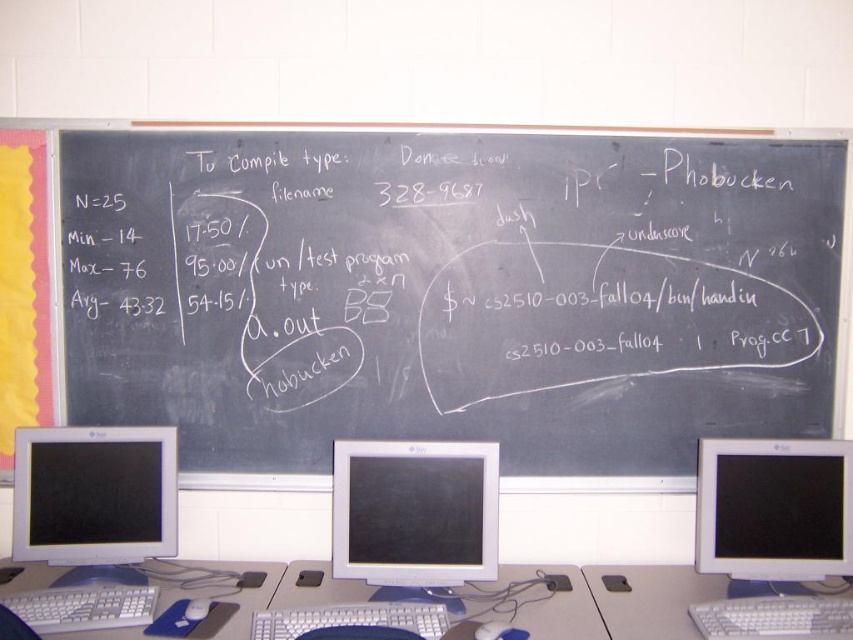
Can you confirm if white glossy monitor at center is wider than white plastic keyboard at center?

In fact, white glossy monitor at center might be narrower than white plastic keyboard at center.

Who is higher up, white glossy monitor at center or white plastic keyboard at center?

white glossy monitor at center is above.

The image size is (853, 640). What do you see at coordinates (415, 513) in the screenshot? I see `white glossy monitor at center` at bounding box center [415, 513].

Identify the location of white glossy monitor at center. The image size is (853, 640). (415, 513).

Is white glossy monitor at center bigger than white plastic table at lower right?

No, white glossy monitor at center is not bigger than white plastic table at lower right.

Is point (373, 525) closer to camera compared to point (635, 580)?

Yes, point (373, 525) is in front of point (635, 580).

Between point (467, 564) and point (630, 612), which one is positioned behind?

Positioned behind is point (467, 564).

This screenshot has width=853, height=640. I want to click on white glossy monitor at center, so click(415, 513).

Between black chalkboard at center and white plastic table at center, which one has more height?

With more height is black chalkboard at center.

Can you confirm if black chalkboard at center is thinner than white plastic table at center?

In fact, black chalkboard at center might be wider than white plastic table at center.

The height and width of the screenshot is (640, 853). What do you see at coordinates (453, 294) in the screenshot? I see `black chalkboard at center` at bounding box center [453, 294].

Identify the location of black chalkboard at center. The width and height of the screenshot is (853, 640). (453, 294).